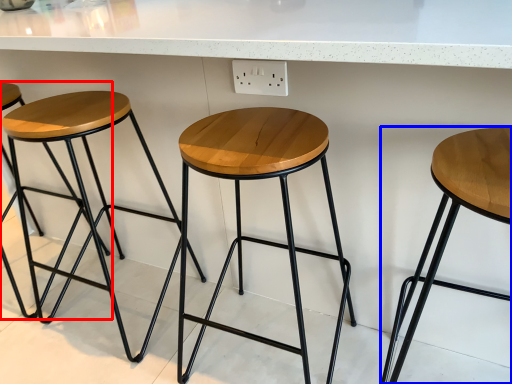
Question: Which of the following is the farthest to the observer, stool (highlighted by a red box) or stool (highlighted by a blue box)?

Choices:
 (A) stool
 (B) stool

Answer: (A)